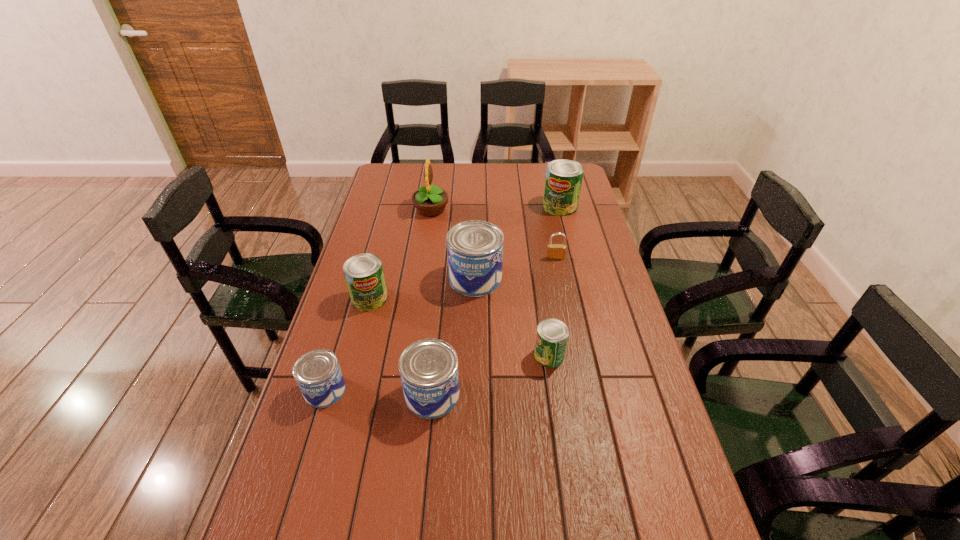
Identify the location of free space between the biggest blue can and the second smallest blue can. (454, 336).

The height and width of the screenshot is (540, 960). Identify the location of vacant area that lies between the leftmost green can and the second biggest blue can. (401, 347).

Identify the location of object that is the fifth closest one to the sunflower. This screenshot has width=960, height=540. (552, 335).

Find the location of a particular element. the sixth closest object to the farthest blue can is located at coordinates (563, 181).

Find the location of a particular element. Image resolution: width=960 pixels, height=540 pixels. can that is the third closest to the rightmost green can is located at coordinates (x=364, y=275).

Identify which can is the fifth nearest to the second smallest blue can. Please provide its 2D coordinates. Your answer should be formatted as a tuple, i.e. [(x, y)], where the tuple contains the x and y coordinates of a point satisfying the conditions above.

[(563, 181)]

Where is `the closest green can relative to the biggest green can`? The width and height of the screenshot is (960, 540). the closest green can relative to the biggest green can is located at coordinates (552, 335).

Find the location of a particular element. This screenshot has height=540, width=960. the third closest green can to the leftmost blue can is located at coordinates 563,181.

Identify which blue can is the second nearest to the second biggest blue can. Please provide its 2D coordinates. Your answer should be formatted as a tuple, i.e. [(x, y)], where the tuple contains the x and y coordinates of a point satisfying the conditions above.

[(475, 248)]

Locate which blue can is the third closest to the nearest green can. Please provide its 2D coordinates. Your answer should be formatted as a tuple, i.e. [(x, y)], where the tuple contains the x and y coordinates of a point satisfying the conditions above.

[(318, 374)]